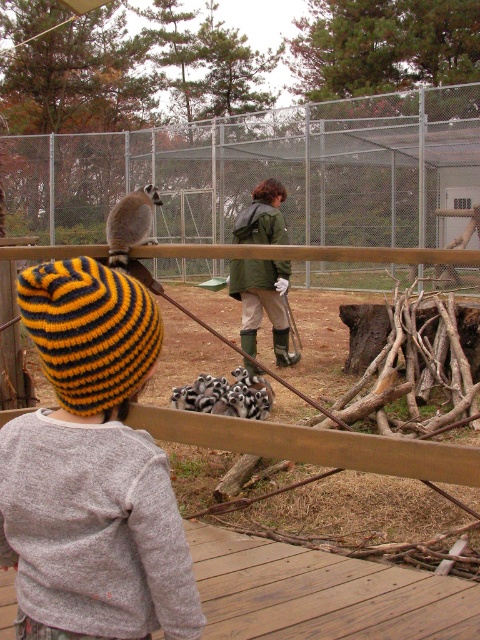
Is black and white striped lemur at center wider than ring-tailed lemur at center?

Incorrect, black and white striped lemur at center's width does not surpass ring-tailed lemur at center's.

Between black and white striped lemur at center and ring-tailed lemur at center, which one is positioned lower?

Positioned lower is black and white striped lemur at center.

Does point (242, 403) come behind point (136, 208)?

Yes, it is.

Where is `black and white striped lemur at center`? This screenshot has height=640, width=480. black and white striped lemur at center is located at coordinates (226, 396).

Based on the photo, is yellow and black knitted beanie at upper left taller than green matte jacket at center?

No.

Can you confirm if yellow and black knitted beanie at upper left is positioned to the right of green matte jacket at center?

Incorrect, yellow and black knitted beanie at upper left is not on the right side of green matte jacket at center.

Does point (156, 468) come farther from viewer compared to point (269, 308)?

No.

I want to click on yellow and black knitted beanie at upper left, so click(x=94, y=467).

From the picture: Who is positioned more to the right, metal fence at upper center or ring-tailed lemur at center?

metal fence at upper center is more to the right.

Does metal fence at upper center lie behind ring-tailed lemur at center?

Yes, metal fence at upper center is behind ring-tailed lemur at center.

This screenshot has width=480, height=640. What do you see at coordinates (264, 172) in the screenshot?
I see `metal fence at upper center` at bounding box center [264, 172].

Locate an element on the screen. metal fence at upper center is located at coordinates (264, 172).